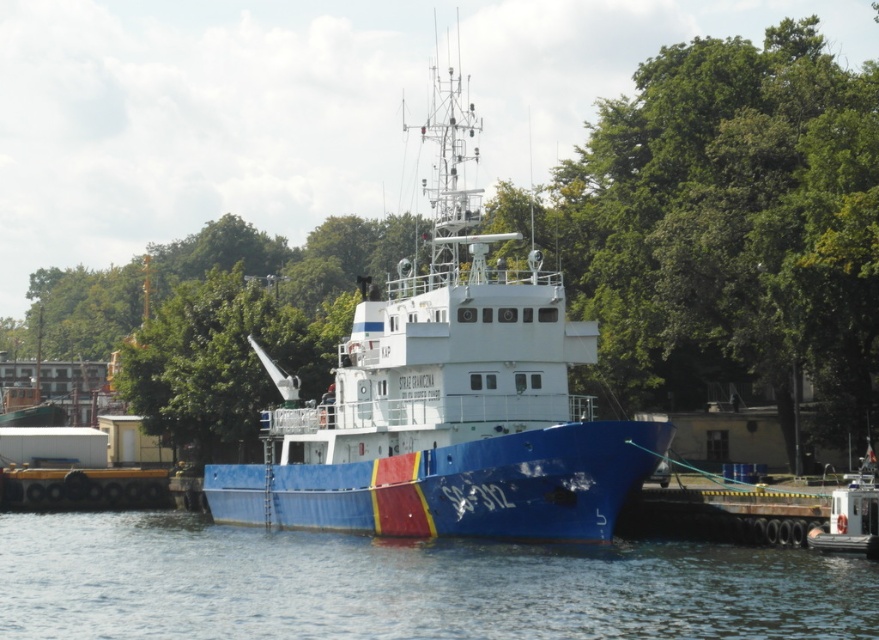
You are standing on the pier and see the blue matte boat at center and the blue glossy water at lower center. Which object is positioned to the right of the other?

Result: The blue matte boat at center is to the right of the blue glossy water at lower center.

You are a photographer standing on the pier next to the SAS ship. You want to take a photo that includes both the blue matte boat at center and the green leafy tree at upper left. Which object should you frame first in your camera viewfinder to ensure both are visible in the shot?

You should frame the blue matte boat at center first because it is larger in size compared to the green leafy tree at upper left, so positioning it first ensures there is enough space to include the smaller tree in the frame.

You are standing on the pier looking at the SAS ship. You notice the blue glossy water at lower center and the green leafy tree at upper left. Which object is closer to the top of the image?

The green leafy tree at upper left is closer to the top of the image.